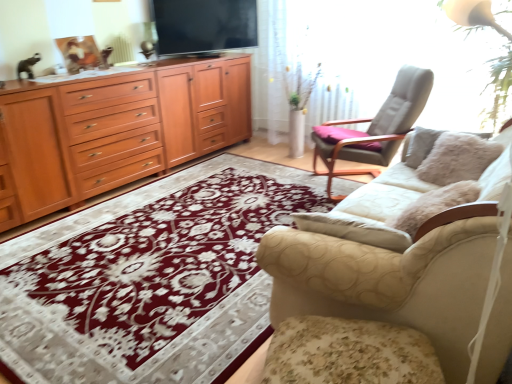
The height and width of the screenshot is (384, 512). In order to click on vacant space that is to the left of light gray fabric chair at upper right in this screenshot , I will do `click(282, 188)`.